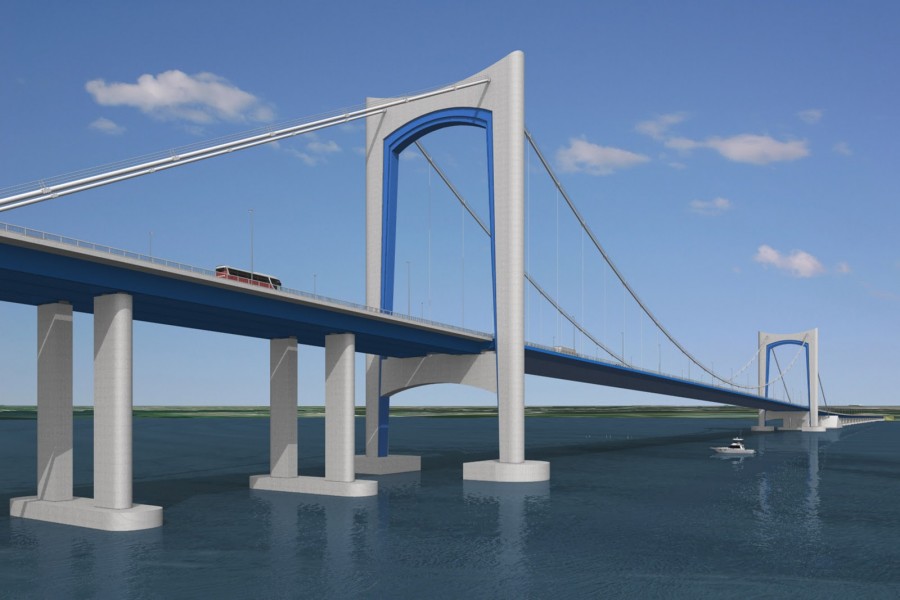
Where is `pillar`? This screenshot has height=600, width=900. pillar is located at coordinates (344, 459), (275, 439), (110, 431), (45, 426).